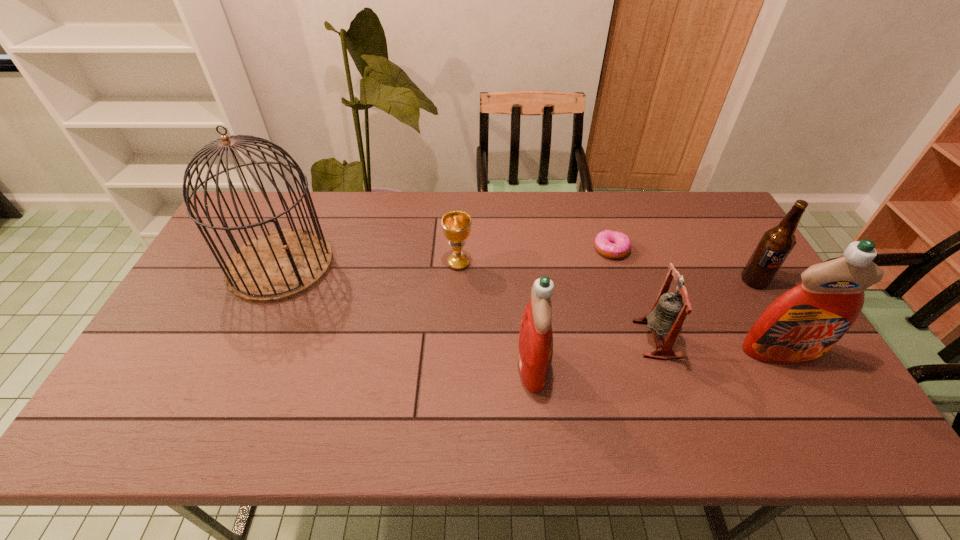
This screenshot has width=960, height=540. Identify the location of the third shortest object. (669, 311).

Locate an element on the screen. free point located on the front surface of the left detergent is located at coordinates (662, 364).

Locate an element on the screen. The height and width of the screenshot is (540, 960). vacant space located 0.070m on the front surface of the right detergent is located at coordinates (804, 392).

The height and width of the screenshot is (540, 960). I want to click on blank area located 0.310m on the left of the second shortest object, so click(x=346, y=263).

Identify the location of free point located on the right of the doughnut. The width and height of the screenshot is (960, 540). (666, 249).

The image size is (960, 540). I want to click on vacant space located 0.310m at the door of the leftmost object, so click(431, 265).

The image size is (960, 540). I want to click on vacant space located on the label of the beer bottle, so click(x=808, y=373).

You are a GUI agent. You are given a task and a screenshot of the screen. Output one action in this format:
    pyautogui.click(x=<x>, y=<y>)
    Task: Click on the free space located 0.080m on the back of the bell
    This screenshot has height=540, width=960.
    Given the screenshot: What is the action you would take?
    pyautogui.click(x=642, y=295)

The image size is (960, 540). Identify the location of object at the far edge. (279, 265).

At what (x,y) coordinates should I click in order to perform the action: click on object that is at the near edge. Please return your answer as a coordinate pair (x, y). The image size is (960, 540). Looking at the image, I should click on (535, 348).